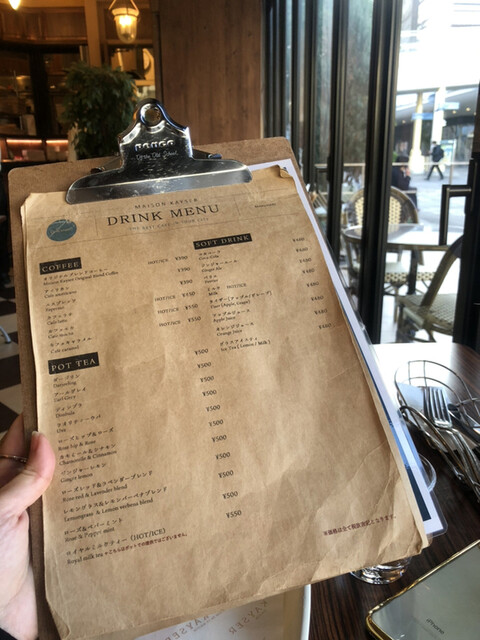
The width and height of the screenshot is (480, 640). Find the location of `clipboard`. clipboard is located at coordinates coord(175,166).